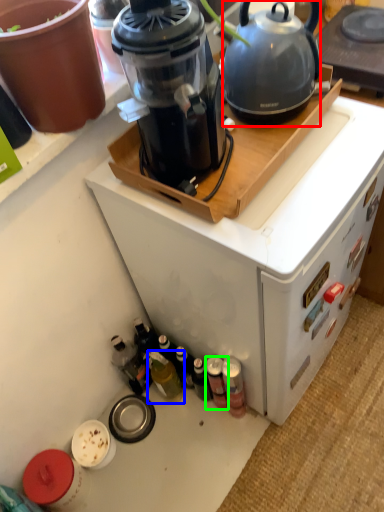
Question: Which object is positioned farthest from kettle (highlighted by a red box)? Select from bottle (highlighted by a blue box) and bottle (highlighted by a green box).

Choices:
 (A) bottle
 (B) bottle

Answer: (A)